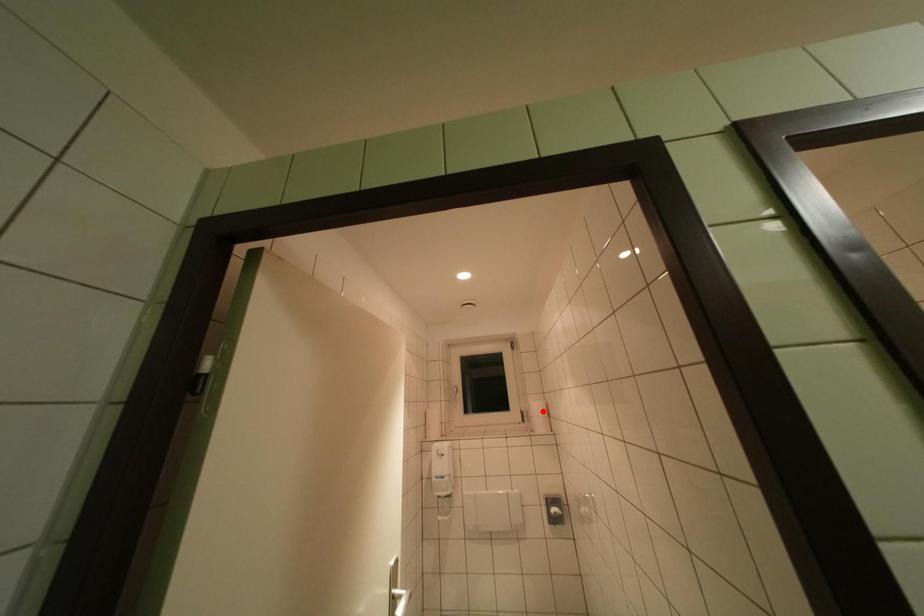
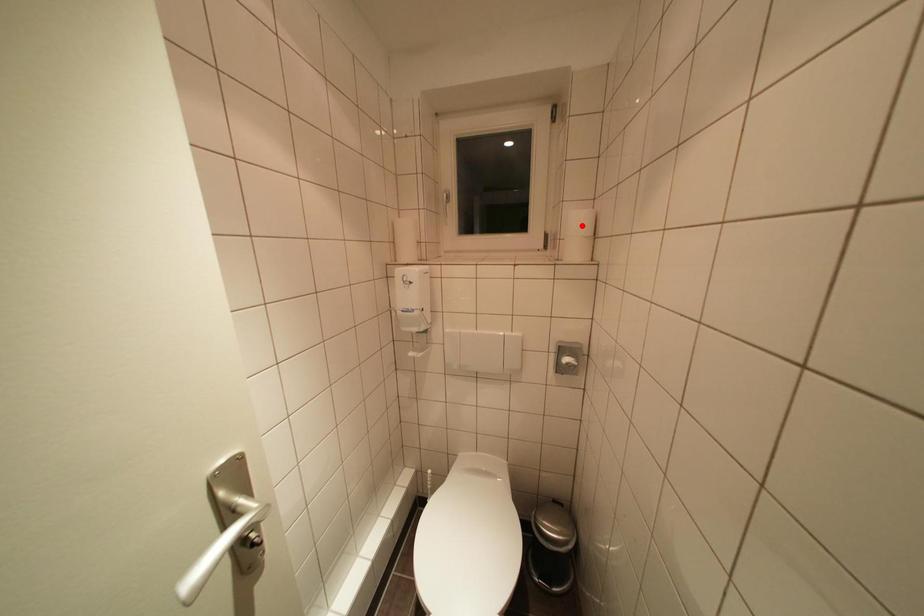
I am providing you with two images of the same scene from different viewpoints. A red point is marked on the first image and another point is marked on the second image. Are the points marked in image1 and image2 representing the same 3D position?

Yes